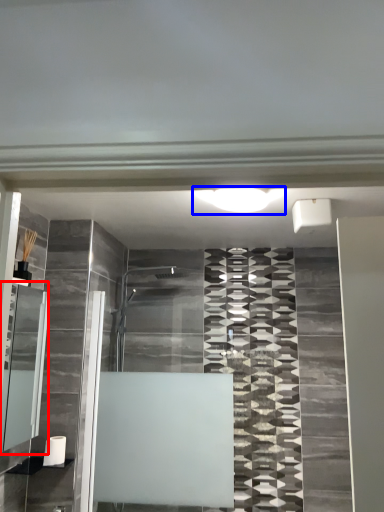
Question: Among these objects, which one is farthest to the camera, cabinet (highlighted by a red box) or light (highlighted by a blue box)?

Choices:
 (A) cabinet
 (B) light

Answer: (B)